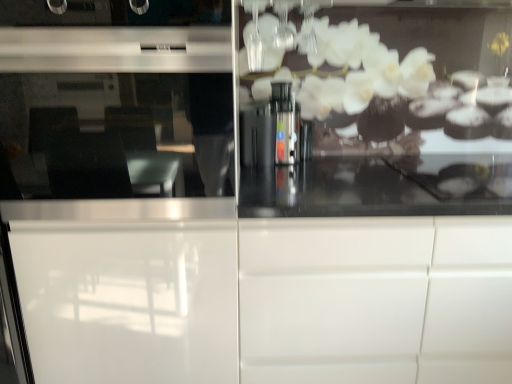
Question: Is white glossy screen door at center completely or partially outside of white glossy cabinet at center?

Choices:
 (A) no
 (B) yes

Answer: (B)

Question: Is white glossy screen door at center oriented towards white glossy cabinet at center?

Choices:
 (A) no
 (B) yes

Answer: (A)

Question: Can you confirm if white glossy screen door at center is positioned to the right of white glossy cabinet at center?

Choices:
 (A) no
 (B) yes

Answer: (A)

Question: Does white glossy screen door at center have a greater height compared to white glossy cabinet at center?

Choices:
 (A) yes
 (B) no

Answer: (A)

Question: Is white glossy screen door at center closer to the viewer compared to white glossy cabinet at center?

Choices:
 (A) yes
 (B) no

Answer: (A)

Question: From the image's perspective, is white glossy screen door at center on white glossy cabinet at center?

Choices:
 (A) no
 (B) yes

Answer: (B)

Question: Is white glossy cabinet at center far from white glossy screen door at center?

Choices:
 (A) no
 (B) yes

Answer: (A)

Question: Does white glossy cabinet at center have a smaller size compared to white glossy screen door at center?

Choices:
 (A) no
 (B) yes

Answer: (B)

Question: Does white glossy cabinet at center come in front of white glossy screen door at center?

Choices:
 (A) no
 (B) yes

Answer: (A)

Question: From a real-world perspective, is white glossy cabinet at center positioned under white glossy screen door at center based on gravity?

Choices:
 (A) yes
 (B) no

Answer: (A)

Question: Is white glossy cabinet at center behind white glossy screen door at center?

Choices:
 (A) no
 (B) yes

Answer: (B)

Question: Can you confirm if white glossy cabinet at center is positioned to the right of white glossy screen door at center?

Choices:
 (A) yes
 (B) no

Answer: (A)

Question: In terms of width, does white glossy cabinet at center look wider or thinner when compared to white glossy screen door at center?

Choices:
 (A) wide
 (B) thin

Answer: (B)